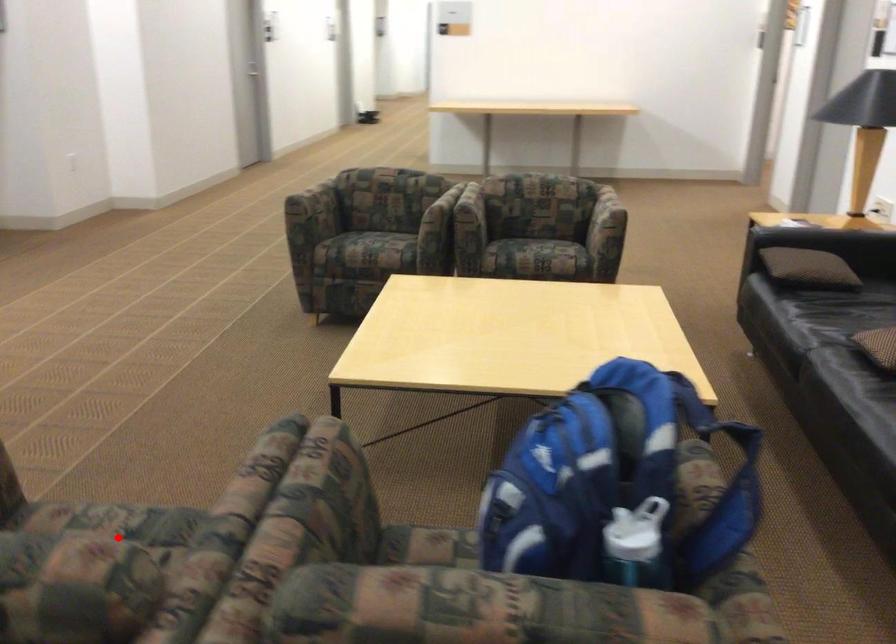
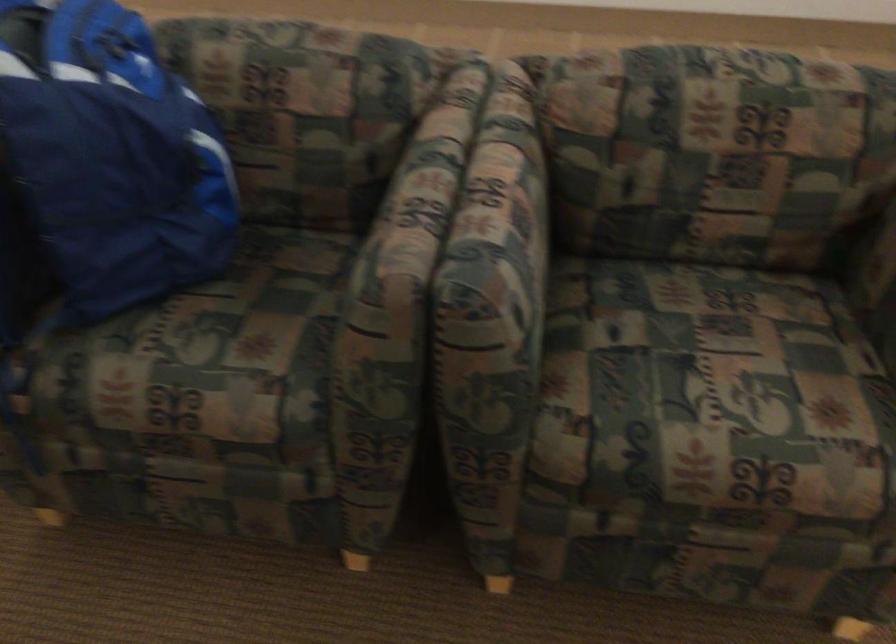
Question: I am providing you with two images of the same scene from different viewpoints. In image1, a red point is highlighted. Considering the same 3D point in image2, which of the following is correct?

Choices:
 (A) It is closer
 (B) It is farther

Answer: (A)